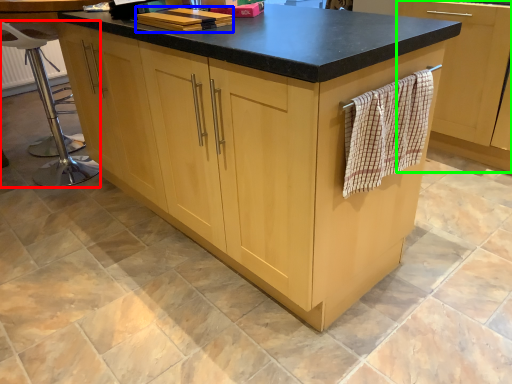
Question: Which object is the closest to the bar stool (highlighted by a red box)? Choose among these: book (highlighted by a blue box) or cabinetry (highlighted by a green box).

Choices:
 (A) book
 (B) cabinetry

Answer: (A)